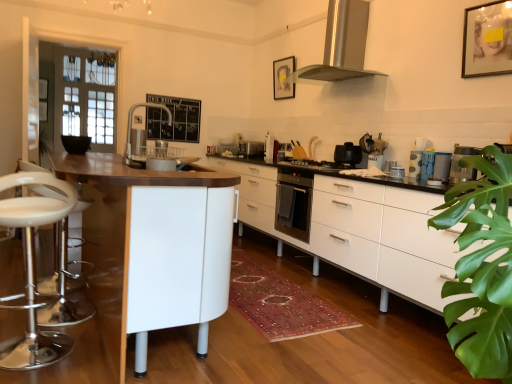
This screenshot has height=384, width=512. Describe the element at coordinates (86, 96) in the screenshot. I see `clear glass door at left` at that location.

Measure the distance between point (87, 95) and camera.

A distance of 4.57 meters exists between point (87, 95) and camera.

How much space does white glossy coffee maker at center, which appears as the 3th appliance when viewed from the front, occupy vertically?

It is 6.05 inches.

In order to face white metallic swivel chair at left, should I rotate leftwards or rightwards?

You should look left and rotate roughly 27.098 degrees.

Locate an element on the screen. This screenshot has height=384, width=512. matte black coffee maker at right, the second kitchen appliance when ordered from left to right is located at coordinates (460, 167).

Where is `satin nickel faucet at center`? satin nickel faucet at center is located at coordinates (131, 124).

The image size is (512, 384). I want to click on matte plastic cups at right, which is the fourth appliance in left-to-right order, so 435,166.

In order to click on clear glass door at left in this screenshot , I will do `click(86, 96)`.

From the image's perspective, is wooden picture frame at upper right, which ranks as the first picture frame in front-to-back order, located above white matte table at center?

Yes, from the image's perspective, wooden picture frame at upper right, which ranks as the first picture frame in front-to-back order, is over white matte table at center.

Where is `table below the wooden picture frame at upper right, which ranks as the first picture frame in front-to-back order (from the image's perspective)`? The width and height of the screenshot is (512, 384). table below the wooden picture frame at upper right, which ranks as the first picture frame in front-to-back order (from the image's perspective) is located at coordinates (157, 243).

In the scene shown: Which is more to the left, wooden picture frame at upper right, which is the 2th picture frame from back to front, or white matte table at center?

white matte table at center.

Between wooden picture frame at upper right, which appears as the 2th picture frame when viewed from the left, and white matte table at center, which one has smaller width?

wooden picture frame at upper right, which appears as the 2th picture frame when viewed from the left.

Could you tell me if white glossy coffee maker at center, which appears as the third appliance when viewed from the right, is turned towards wooden picture frame at upper right, arranged as the first picture frame when viewed from the right?

No, white glossy coffee maker at center, which appears as the third appliance when viewed from the right, is not turned towards wooden picture frame at upper right, arranged as the first picture frame when viewed from the right.

Is white glossy coffee maker at center, which appears as the 4th appliance when viewed from the top, in contact with wooden picture frame at upper right, arranged as the first picture frame when viewed from the right?

No, white glossy coffee maker at center, which appears as the 4th appliance when viewed from the top, is not in contact with wooden picture frame at upper right, arranged as the first picture frame when viewed from the right.

Between point (402, 172) and point (500, 19), which one is positioned behind?

The point (402, 172) is more distant.

From the image's perspective, starting from the wooden picture frame at upper right, arranged as the first picture frame when viewed from the right, which appliance is the 4th one below? Please provide its 2D coordinates.

[(397, 172)]

Would you consider white matte cabinet at center to be distant from white metallic swivel chair at left?

Yes, white matte cabinet at center is far from white metallic swivel chair at left.

Measure the distance between white matte cabinet at center and white metallic swivel chair at left.

They are 2.09 meters apart.

Is point (250, 186) farther from camera compared to point (59, 349)?

Yes.

How many degrees apart are the facing directions of white matte cabinet at center and white metallic swivel chair at left?

They differ by 93 degrees in their facing directions.

Who is shorter, matte plastic cups at right, which is the 2th appliance in bottom-to-top order, or stainless steel range hood at upper center?

matte plastic cups at right, which is the 2th appliance in bottom-to-top order, is shorter.

Is matte plastic cups at right, which is the 2th appliance in bottom-to-top order, located outside stainless steel range hood at upper center?

Yes.

From a real-world perspective, is matte plastic cups at right, which is counted as the fourth appliance, starting from the back, physically located above or below stainless steel range hood at upper center?

Clearly, from a real-world perspective, matte plastic cups at right, which is counted as the fourth appliance, starting from the back, is below stainless steel range hood at upper center.

How many degrees apart are the facing directions of matte plastic cups at right, which is counted as the fourth appliance, starting from the back, and stainless steel range hood at upper center?

0.0214 degrees separate the facing orientations of matte plastic cups at right, which is counted as the fourth appliance, starting from the back, and stainless steel range hood at upper center.

Considering the sizes of objects white metallic swivel chair at left and white glossy coffee maker at center, arranged as the third appliance when viewed from the left, in the image provided, who is bigger, white metallic swivel chair at left or white glossy coffee maker at center, arranged as the third appliance when viewed from the left,?

white metallic swivel chair at left.

From a real-world perspective, does white metallic swivel chair at left sit lower than white glossy coffee maker at center, which is the second appliance from top to bottom?

Yes, from a real-world perspective, white metallic swivel chair at left is under white glossy coffee maker at center, which is the second appliance from top to bottom.

In the scene shown: Is white metallic swivel chair at left touching white glossy coffee maker at center, the third appliance in the bottom-to-top sequence?

No, white metallic swivel chair at left is not beside white glossy coffee maker at center, the third appliance in the bottom-to-top sequence.

From a real-world perspective, count 2nd appliances upward from the white metallic swivel chair at left and point to it. Please provide its 2D coordinates.

[(375, 160)]

Looking at the image, does satin silver toaster at center, the fourth appliance when ordered from bottom to top, seem bigger or smaller compared to white glossy coffee maker at center, which appears as the third appliance when viewed from the right?

In the image, satin silver toaster at center, the fourth appliance when ordered from bottom to top, appears to be larger than white glossy coffee maker at center, which appears as the third appliance when viewed from the right.

Looking at this image, considering the sizes of objects satin silver toaster at center, the fourth appliance when ordered from bottom to top, and white glossy coffee maker at center, which is the second appliance from left to right, in the image provided, who is shorter, satin silver toaster at center, the fourth appliance when ordered from bottom to top, or white glossy coffee maker at center, which is the second appliance from left to right,?

white glossy coffee maker at center, which is the second appliance from left to right.

From the image's perspective, is satin silver toaster at center, the first appliance from the back, below white glossy coffee maker at center, which appears as the 4th appliance when viewed from the top?

No.

Is point (98, 129) closer to camera compared to point (330, 167)?

No, (98, 129) is further to viewer.

Locate an element on the screen. gas stove below the clear glass door at left (from the image's perspective) is located at coordinates (314, 165).

Is clear glass door at left not near black matte gas stove at center?

Yes, clear glass door at left is far from black matte gas stove at center.

Do you think clear glass door at left is within black matte gas stove at center, or outside of it?

clear glass door at left is not enclosed by black matte gas stove at center.

The height and width of the screenshot is (384, 512). In order to click on the 1st picture frame behind the white matte table at center in this screenshot , I will do 487,40.

From the image's perspective, which appliance is the 4th one below the wooden picture frame at upper right, arranged as the first picture frame when viewed from the right? Please provide its 2D coordinates.

[(397, 172)]

Looking at the image, which one is located further to clear glass door at left, matte black coffee maker at right, which ranks as the second kitchen appliance in back-to-front order, or satin nickel faucet at center?

matte black coffee maker at right, which ranks as the second kitchen appliance in back-to-front order.

Estimate the real-world distances between objects in this image. Which object is further from white glossy coffee maker at center, which appears as the 4th appliance when viewed from the top, matte plastic cups at right, positioned as the 3th appliance in top-to-bottom order, or white glossy coffee maker at center, the third appliance in the bottom-to-top sequence?

Based on the image, white glossy coffee maker at center, the third appliance in the bottom-to-top sequence, appears to be further to white glossy coffee maker at center, which appears as the 4th appliance when viewed from the top.

Based on their spatial positions, is matte plastic cups at right, acting as the 1th appliance starting from the front, or matte black coffee maker at right, acting as the first kitchen appliance starting from the right, closer to satin nickel faucet at center?

matte plastic cups at right, acting as the 1th appliance starting from the front, is positioned closer to the anchor satin nickel faucet at center.

Looking at the image, which one is located closer to black matte gas stove at center, black plastic toaster at center, the first kitchen appliance from the back, or satin nickel faucet at center?

black plastic toaster at center, the first kitchen appliance from the back, is positioned closer to the anchor black matte gas stove at center.

Which object lies nearer to the anchor point stainless steel range hood at upper center, matte black coffee maker at right, which ranks as the second kitchen appliance in back-to-front order, or satin nickel faucet at center?

matte black coffee maker at right, which ranks as the second kitchen appliance in back-to-front order, lies closer to stainless steel range hood at upper center than the other object.

Estimate the real-world distances between objects in this image. Which object is closer to stainless steel range hood at upper center, black plastic toaster at center, the first kitchen appliance from the back, or white glossy coffee maker at center, the third appliance in the bottom-to-top sequence?

Among the two, black plastic toaster at center, the first kitchen appliance from the back, is located nearer to stainless steel range hood at upper center.

Which object lies nearer to the anchor point matte plastic cups at right, which is the 2th appliance in bottom-to-top order, satin nickel faucet at center or black matte gas stove at center?

Among the two, black matte gas stove at center is located nearer to matte plastic cups at right, which is the 2th appliance in bottom-to-top order.

Based on their spatial positions, is matte plastic cups at right, which is the 2th appliance in bottom-to-top order, or white glossy coffee maker at center, which appears as the third appliance when viewed from the right, closer to clear glass door at left?

The object closer to clear glass door at left is white glossy coffee maker at center, which appears as the third appliance when viewed from the right.

Image resolution: width=512 pixels, height=384 pixels. I want to click on gas stove located between stainless steel range hood at upper center and matte black picture frame at upper center, the second picture frame when ordered from front to back, in the depth direction, so click(314, 165).

Identify the location of gas stove between white metallic swivel chair at left and clear glass door at left along the z-axis. The width and height of the screenshot is (512, 384). (314, 165).

Locate an element on the screen. Image resolution: width=512 pixels, height=384 pixels. picture frame between clear glass door at left and matte plastic cups at right, acting as the 1th appliance starting from the front is located at coordinates (283, 78).

Locate an element on the screen. cabinetry located between clear glass door at left and black plastic toaster at center, the 2th kitchen appliance viewed from the right, in the left-right direction is located at coordinates (362, 230).